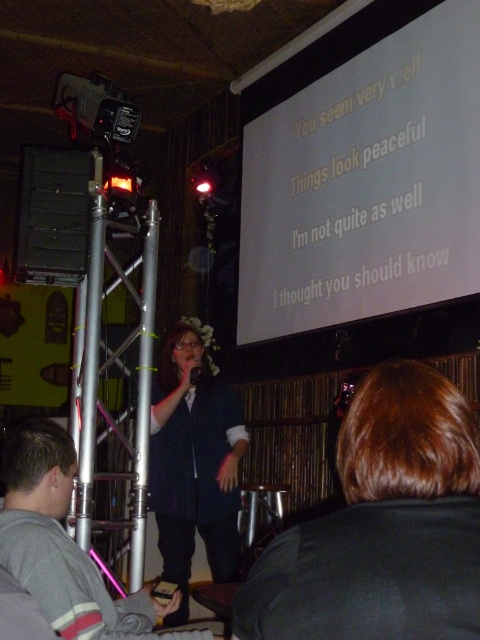
From the picture: You are a stagehand trying to position a spotlight. You need to place it so it shines on the point at coordinates point (x=357, y=524) first before reaching point (x=191, y=384). Is this possible given their positions?

Yes, because point (x=357, y=524) is in front of point (x=191, y=384), so the spotlight can first hit the closer point before the light continues to the farther one.

You are a stagehand who needs to hand the matte black microphone at center to the performer wearing the gray fleece sweatshirt at lower left. Can you do this without moving more than 1.5 meters from your current position?

The distance between the gray fleece sweatshirt at lower left and the matte black microphone at center is 1.38 meters, so yes, you can hand the matte black microphone at center to the performer wearing the gray fleece sweatshirt at lower left without moving more than 1.5 meters.